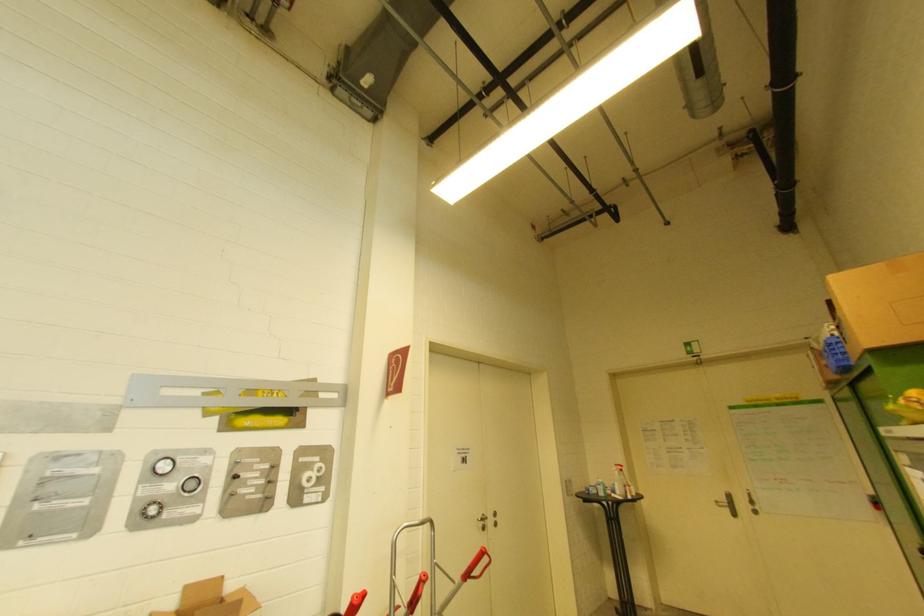
The image size is (924, 616). What do you see at coordinates (152, 509) in the screenshot?
I see `the spray bottle trigger` at bounding box center [152, 509].